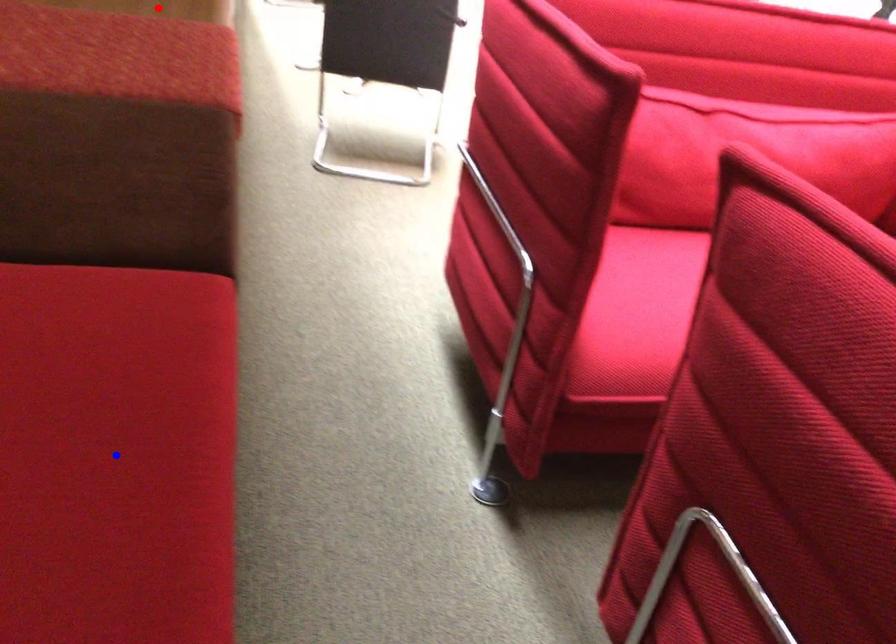
Question: In the image, two points are highlighted. Which point is nearer to the camera? Reply with the corresponding letter.

Choices:
 (A) blue point
 (B) red point

Answer: (A)